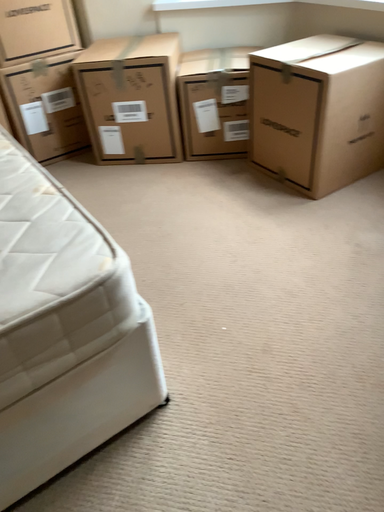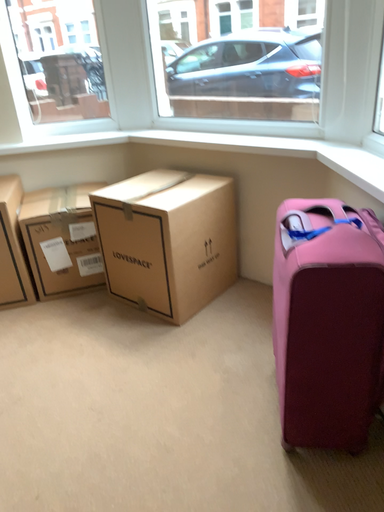
Question: Which way did the camera rotate in the video?

Choices:
 (A) rotated upward
 (B) rotated downward

Answer: (A)